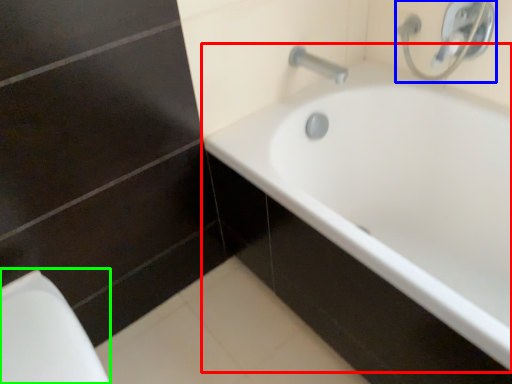
Question: Which object is the closest to the bathtub (highlighted by a red box)? Choose among these: plumbing fixture (highlighted by a blue box) or porcelain (highlighted by a green box).

Choices:
 (A) plumbing fixture
 (B) porcelain

Answer: (A)